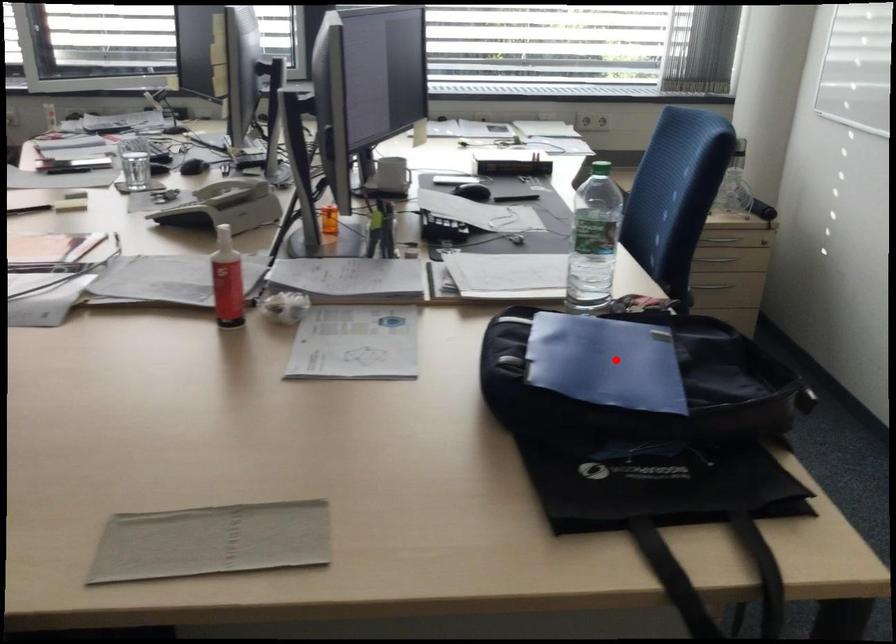
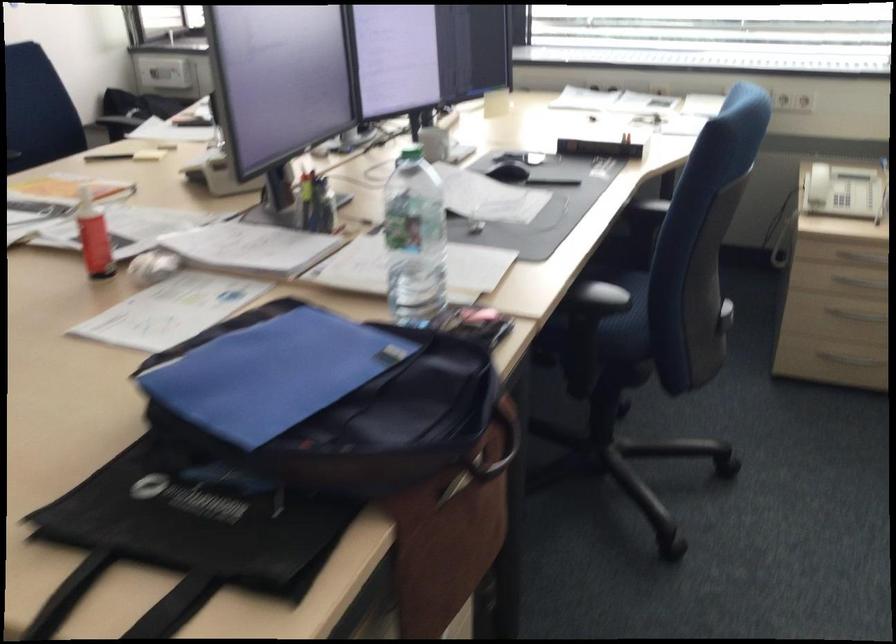
Locate, in the second image, the point that corresponds to the highlighted location in the first image.

(271, 374)